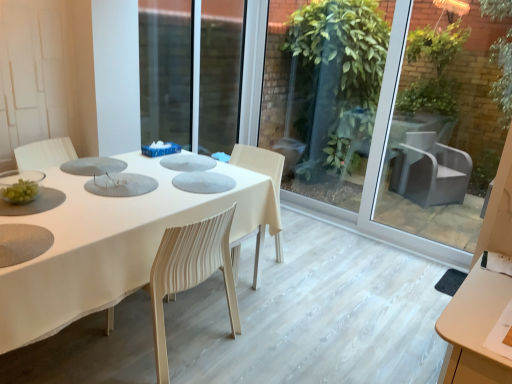
Find the location of a particular element. The width and height of the screenshot is (512, 384). empty space that is ontop of white fabric table at center (from a real-world perspective) is located at coordinates (129, 180).